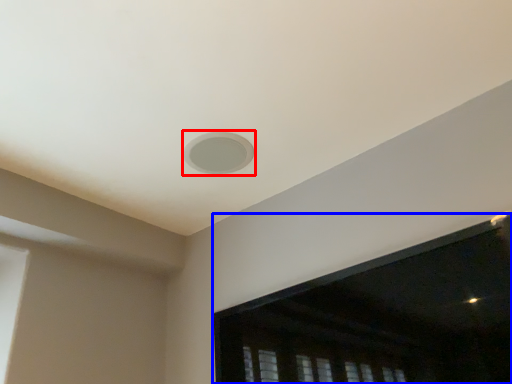
Question: Which point is further to the camera, hole (highlighted by a red box) or window screen (highlighted by a blue box)?

Choices:
 (A) hole
 (B) window screen

Answer: (A)